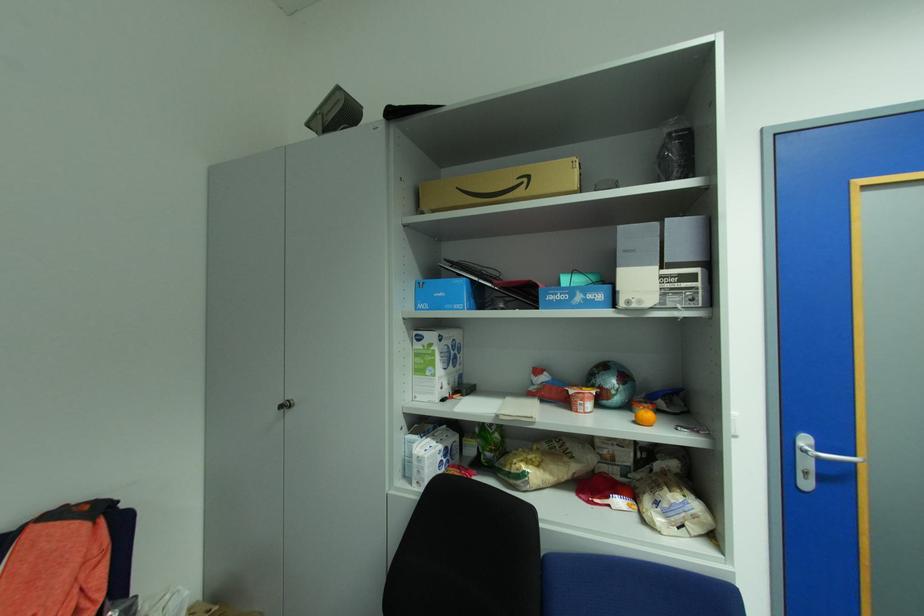
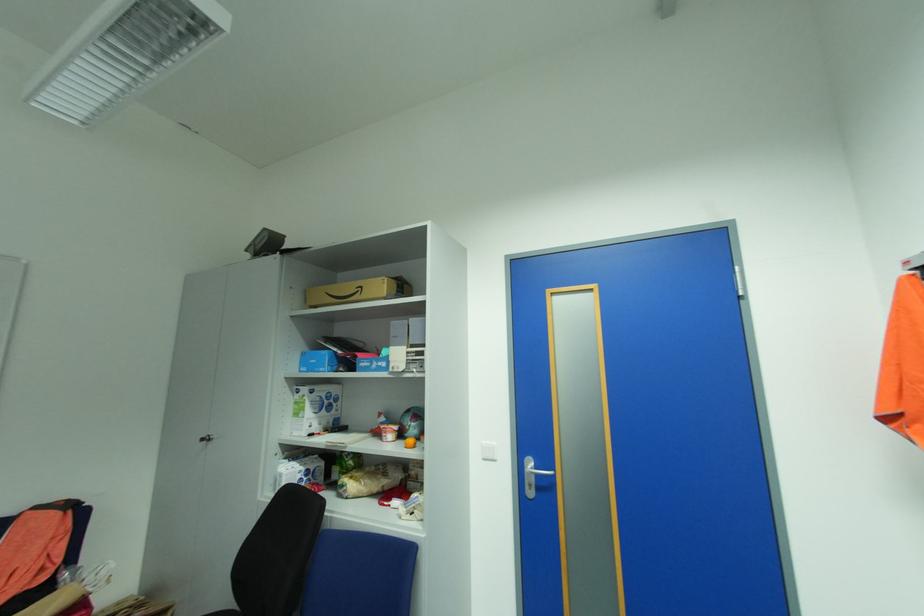
Where in the second image is the point corresponding to point (642, 424) from the first image?

(412, 447)